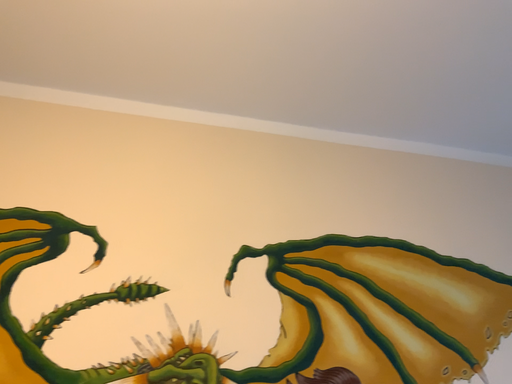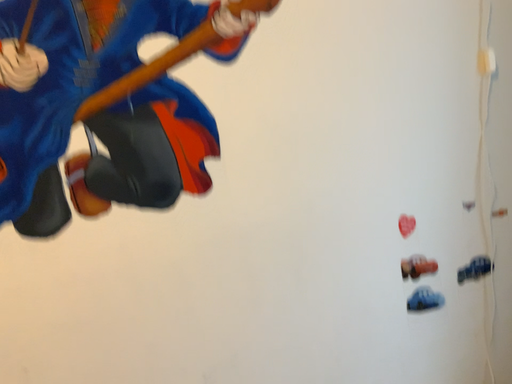
Question: How did the camera likely rotate when shooting the video?

Choices:
 (A) rotated left
 (B) rotated right

Answer: (B)